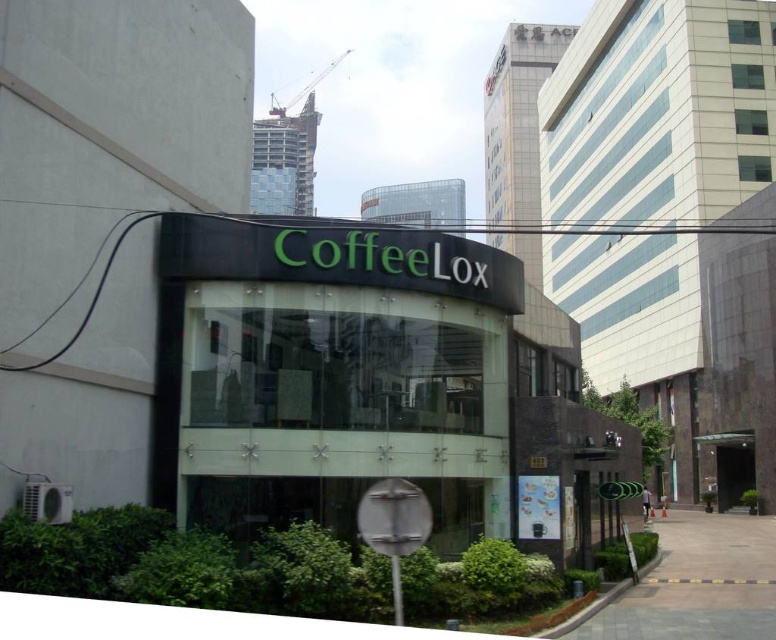
Is paved stone pavement at center bigger than metallic gray crane at upper center?

Actually, paved stone pavement at center might be smaller than metallic gray crane at upper center.

Who is shorter, paved stone pavement at center or metallic gray crane at upper center?

paved stone pavement at center

Does point (650, 637) come behind point (341, 58)?

That is False.

Where is `paved stone pavement at center`? The height and width of the screenshot is (640, 776). paved stone pavement at center is located at coordinates click(x=697, y=582).